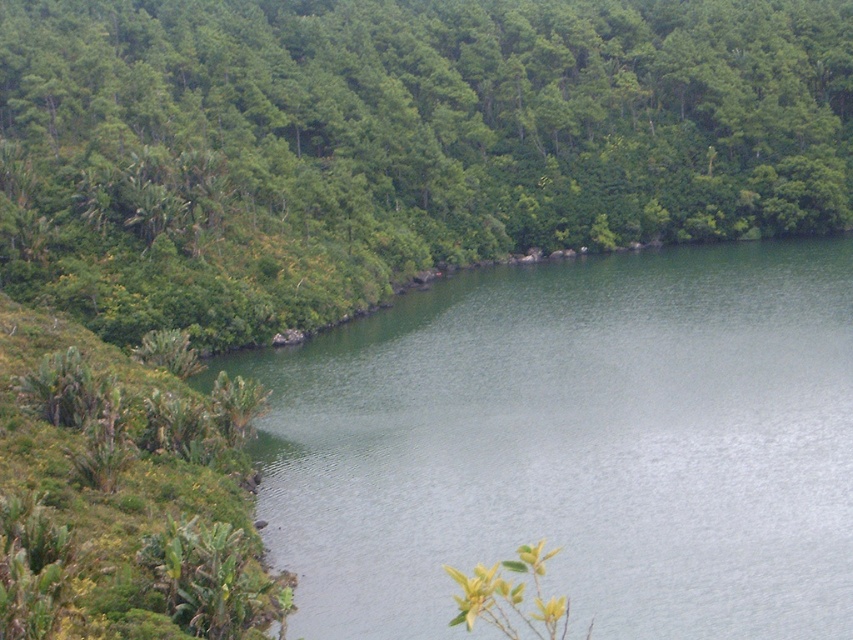
You are a bird looking for a place to land. You see the green leafy tree at center and the green smooth water at center. Which one has a wider area to land on?

The green leafy tree at center has a wider area to land on because its width surpasses that of the green smooth water at center.